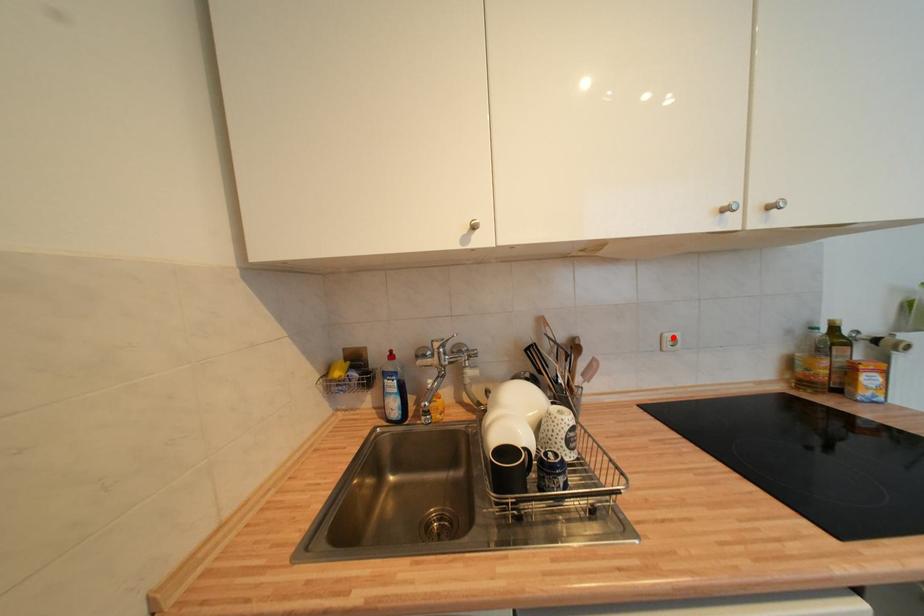
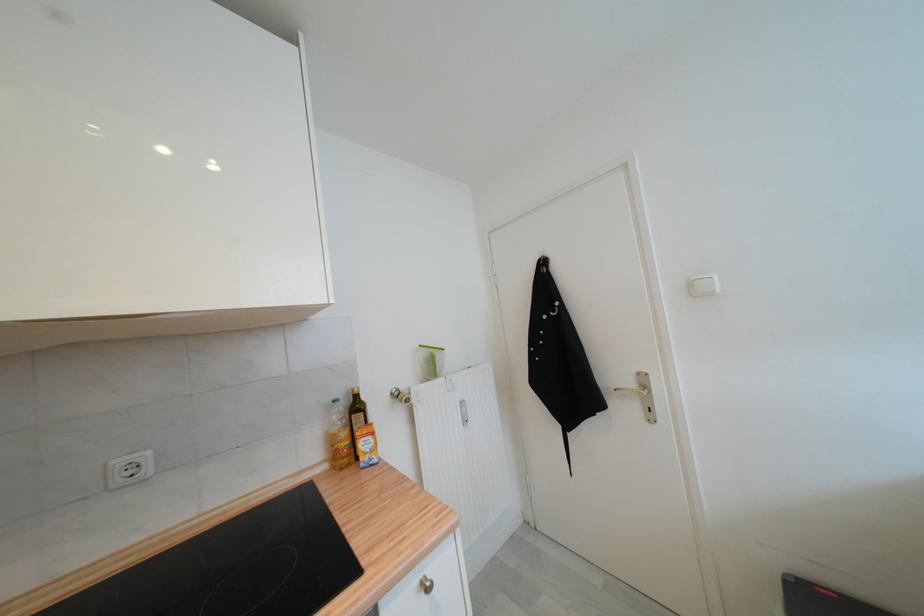
The point at the highlighted location is marked in the first image. Where is the corresponding point in the second image?

(126, 464)